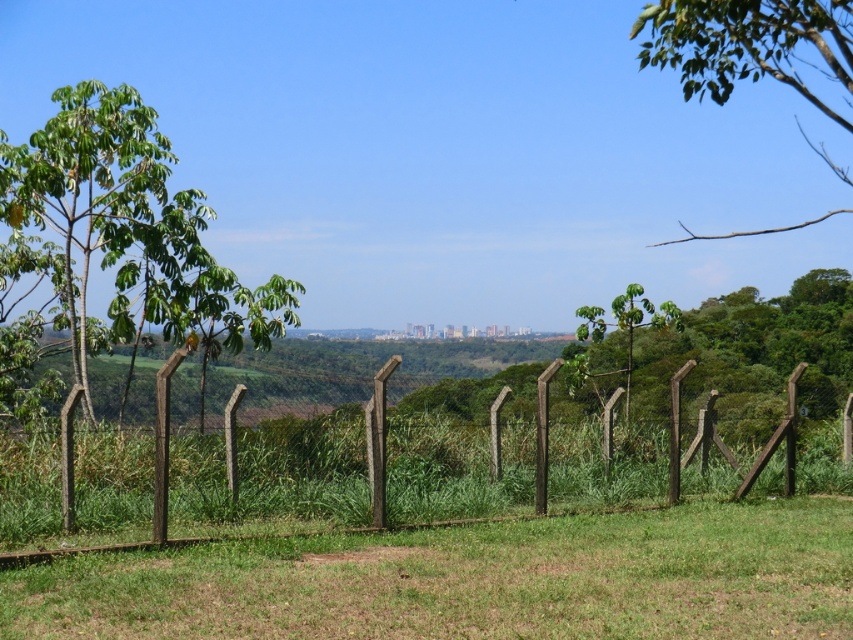
Question: In this image, where is green leafy tree at left located relative to green leafy branch at upper right?

Choices:
 (A) right
 (B) left

Answer: (B)

Question: Which of these objects is positioned closest to the green leafy tree at left?

Choices:
 (A) green leafy branch at upper right
 (B) brown wooden fence at center

Answer: (B)

Question: Which of the following is the farthest from the observer?

Choices:
 (A) brown wooden fence at center
 (B) green leafy tree at left
 (C) green leafy branch at upper right

Answer: (B)

Question: Considering the real-world distances, which object is closest to the brown wooden fence at center?

Choices:
 (A) green leafy branch at upper right
 (B) green leafy tree at left

Answer: (B)

Question: Is brown wooden fence at center further to camera compared to green leafy tree at left?

Choices:
 (A) no
 (B) yes

Answer: (A)

Question: Is brown wooden fence at center behind green leafy tree at left?

Choices:
 (A) no
 (B) yes

Answer: (A)